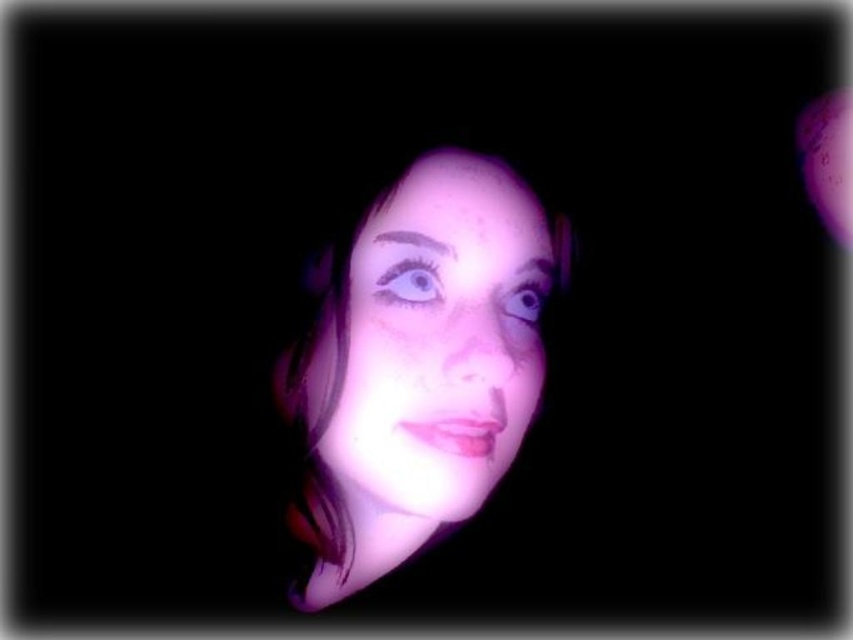
Is purple matte face at center positioned before shiny blue eye at center?

Yes, purple matte face at center is in front of shiny blue eye at center.

In the scene shown: Does purple matte face at center appear over shiny blue eye at center?

No, purple matte face at center is not above shiny blue eye at center.

This screenshot has height=640, width=853. I want to click on purple matte face at center, so [434, 342].

Identify the location of purple matte face at center. The height and width of the screenshot is (640, 853). (434, 342).

Who is taller, purple matte face at center or purple glossy eye at upper center?

Standing taller between the two is purple matte face at center.

Which is below, purple matte face at center or purple glossy eye at upper center?

purple matte face at center

Is point (479, 390) closer to viewer compared to point (434, 280)?

Yes, it is in front of point (434, 280).

Where is `purple matte face at center`? The height and width of the screenshot is (640, 853). purple matte face at center is located at coordinates (434, 342).

Find the location of a particular element. purple glossy eye at upper center is located at coordinates (408, 284).

Does point (401, 285) lie behind point (526, 292)?

No, it is not.

This screenshot has height=640, width=853. What do you see at coordinates (408, 284) in the screenshot?
I see `purple glossy eye at upper center` at bounding box center [408, 284].

What are the coordinates of `purple glossy eye at upper center` in the screenshot? It's located at (408, 284).